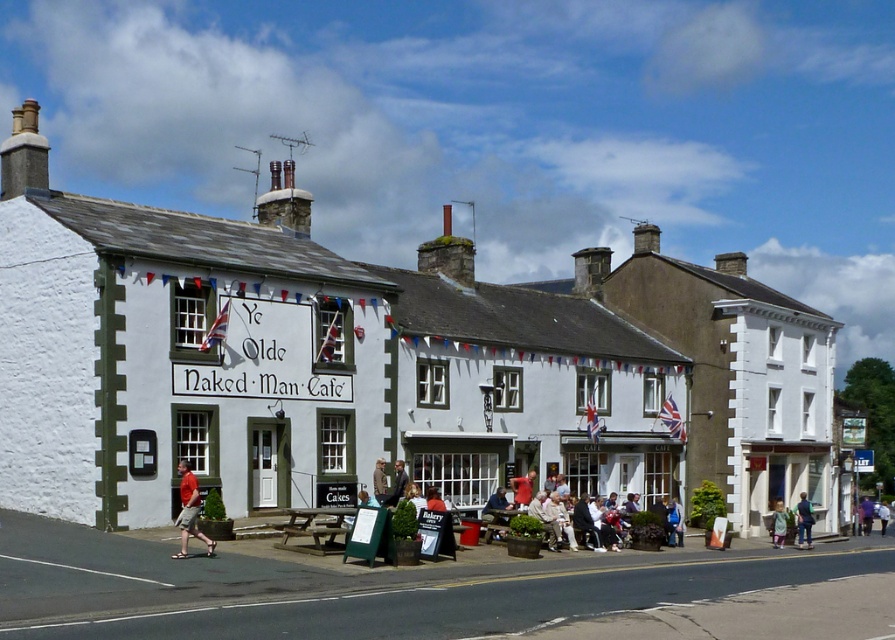
Is matte brown jacket at center thinner than khaki fabric jacket at center?

In fact, matte brown jacket at center might be wider than khaki fabric jacket at center.

You are a GUI agent. You are given a task and a screenshot of the screen. Output one action in this format:
    pyautogui.click(x=<x>, y=<y>)
    Task: Click on the matte brown jacket at center
    
    Given the screenshot: What is the action you would take?
    pyautogui.click(x=522, y=490)

Does blue denim jeans at lower right appear on the left side of leather jacket at center?

In fact, blue denim jeans at lower right is to the right of leather jacket at center.

Is blue denim jeans at lower right bigger than leather jacket at center?

Indeed, blue denim jeans at lower right has a larger size compared to leather jacket at center.

What do you see at coordinates (803, 520) in the screenshot?
I see `blue denim jeans at lower right` at bounding box center [803, 520].

Identify the location of blue denim jeans at lower right. The height and width of the screenshot is (640, 895). (803, 520).

Based on the photo, between leather jacket at center and matte brown jacket at center, which one has less height?

Standing shorter between the two is leather jacket at center.

Measure the distance between leather jacket at center and camera.

leather jacket at center and camera are 141.81 feet apart from each other.

What do you see at coordinates (495, 506) in the screenshot?
I see `leather jacket at center` at bounding box center [495, 506].

Where is `leather jacket at center`? This screenshot has width=895, height=640. leather jacket at center is located at coordinates (495, 506).